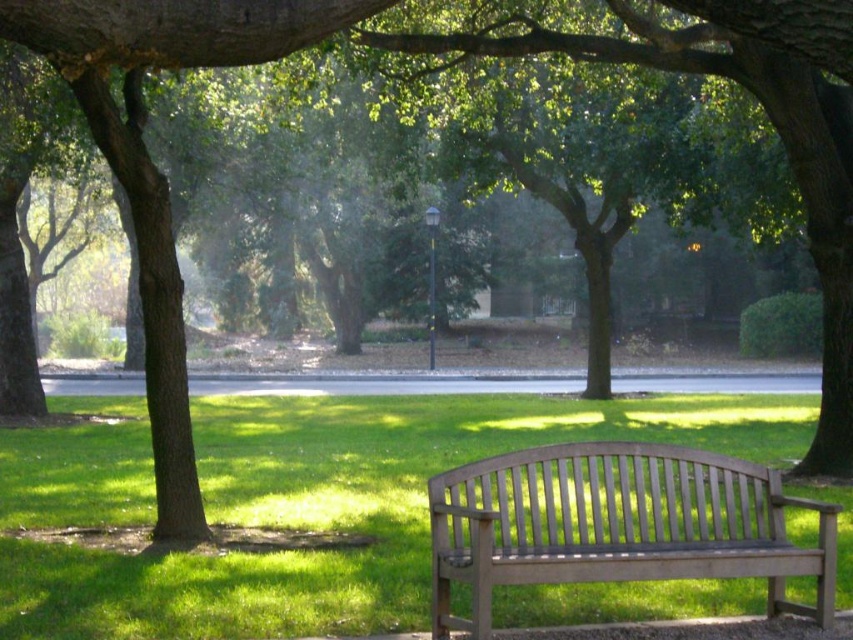
Question: Is green grass at center bigger than light brown wooden bench at center?

Choices:
 (A) yes
 (B) no

Answer: (A)

Question: Is green grass at center thinner than light brown wooden bench at center?

Choices:
 (A) no
 (B) yes

Answer: (A)

Question: Is green grass at center behind light brown wooden bench at center?

Choices:
 (A) no
 (B) yes

Answer: (B)